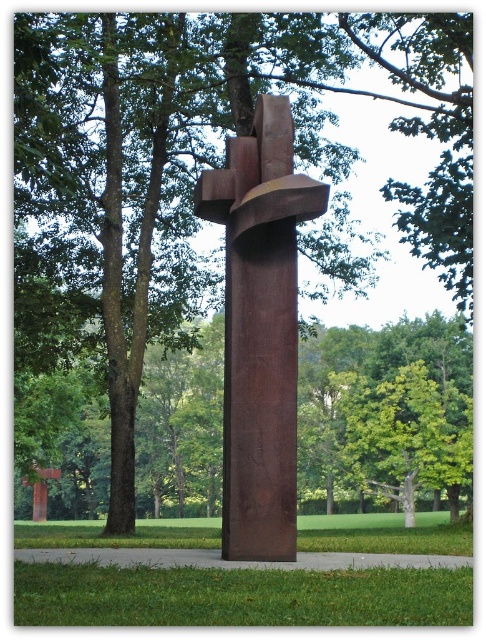
Question: Which point is closer to the camera?

Choices:
 (A) rusty metal cross at lower left
 (B) rusty metal sculpture at center

Answer: (B)

Question: Does rusty metal sculpture at center have a lesser width compared to rusty metal cross at lower left?

Choices:
 (A) no
 (B) yes

Answer: (A)

Question: Is rusty metal sculpture at center positioned behind rusty metal cross at lower left?

Choices:
 (A) no
 (B) yes

Answer: (A)

Question: Can you confirm if rusty metal sculpture at center is positioned below rusty metal cross at lower left?

Choices:
 (A) yes
 (B) no

Answer: (B)